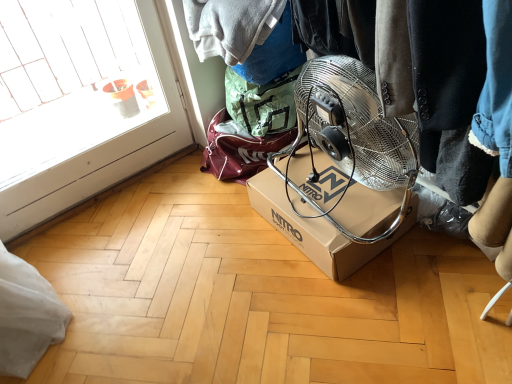
At what (x,y) coordinates should I click in order to perform the action: click on free spot above brown cardboard box at center (from a real-world perspective). Please return your answer as a coordinate pair (x, y). The image size is (512, 384). Looking at the image, I should click on (325, 185).